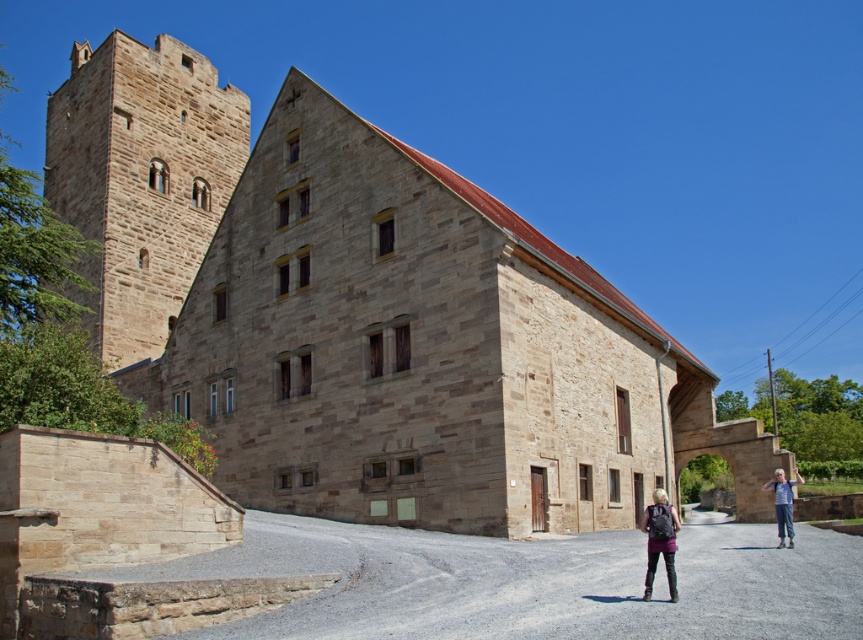
Can you confirm if brown stone tower at upper left is taller than matte purple jacket at lower center?

Correct, brown stone tower at upper left is much taller as matte purple jacket at lower center.

Does point (197, 252) lie in front of point (669, 516)?

No, (197, 252) is further to viewer.

What are the coordinates of `brown stone tower at upper left` in the screenshot? It's located at (142, 179).

The image size is (863, 640). What are the coordinates of `brown stone tower at upper left` in the screenshot? It's located at (142, 179).

Does brown stone tower at upper left lie in front of denim pants at lower right?

No, brown stone tower at upper left is further to the viewer.

Can you confirm if brown stone tower at upper left is wider than denim pants at lower right?

Indeed, brown stone tower at upper left has a greater width compared to denim pants at lower right.

Who is more distant from viewer, (225, 161) or (788, 516)?

Positioned behind is point (225, 161).

Locate an element on the screen. The width and height of the screenshot is (863, 640). brown stone tower at upper left is located at coordinates (142, 179).

Does matte purple jacket at lower center have a smaller size compared to denim pants at lower right?

No.

Measure the distance between matte purple jacket at lower center and denim pants at lower right.

matte purple jacket at lower center and denim pants at lower right are 12.76 meters apart.

The height and width of the screenshot is (640, 863). Find the location of `matte purple jacket at lower center`. matte purple jacket at lower center is located at coordinates (660, 540).